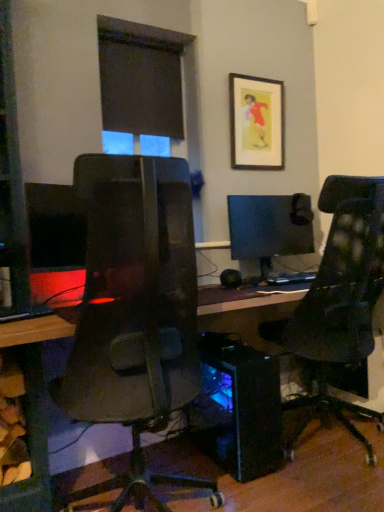
Question: From a real-world perspective, is matte black monitor at left, the 2th computer monitor positioned from the right, located beneath transparent blue computer tower at center?

Choices:
 (A) yes
 (B) no

Answer: (B)

Question: Considering the relative sizes of matte black monitor at left, the first computer monitor in the left-to-right sequence, and transparent blue computer tower at center in the image provided, is matte black monitor at left, the first computer monitor in the left-to-right sequence, smaller than transparent blue computer tower at center?

Choices:
 (A) no
 (B) yes

Answer: (B)

Question: From a real-world perspective, is matte black monitor at left, the 2th computer monitor positioned from the right, physically above transparent blue computer tower at center?

Choices:
 (A) no
 (B) yes

Answer: (B)

Question: Could you tell me if matte black monitor at left, the first computer monitor in the left-to-right sequence, is facing transparent blue computer tower at center?

Choices:
 (A) no
 (B) yes

Answer: (A)

Question: Is matte black monitor at left, the first computer monitor in the left-to-right sequence, taller than transparent blue computer tower at center?

Choices:
 (A) yes
 (B) no

Answer: (B)

Question: Considering the positions of point (243, 475) and point (51, 244), is point (243, 475) closer or farther from the camera than point (51, 244)?

Choices:
 (A) closer
 (B) farther

Answer: (B)

Question: In the image, is transparent blue computer tower at center positioned in front of or behind matte black monitor at left, which appears as the 1th computer monitor when viewed from the front?

Choices:
 (A) behind
 (B) front

Answer: (A)

Question: Considering the positions of transparent blue computer tower at center and matte black monitor at left, which appears as the 1th computer monitor when viewed from the front, in the image, is transparent blue computer tower at center bigger or smaller than matte black monitor at left, which appears as the 1th computer monitor when viewed from the front,?

Choices:
 (A) small
 (B) big

Answer: (B)

Question: From their relative heights in the image, would you say transparent blue computer tower at center is taller or shorter than matte black monitor at left, placed as the 2th computer monitor when sorted from back to front?

Choices:
 (A) short
 (B) tall

Answer: (B)

Question: Is wooden framed picture at upper center in front of or behind matte black monitor at center, the first computer monitor positioned from the back, in the image?

Choices:
 (A) front
 (B) behind

Answer: (B)

Question: Considering the positions of point (268, 120) and point (304, 223), is point (268, 120) closer or farther from the camera than point (304, 223)?

Choices:
 (A) farther
 (B) closer

Answer: (B)

Question: Based on their positions, is wooden framed picture at upper center located to the left or right of matte black monitor at center, the 1th computer monitor positioned from the right?

Choices:
 (A) right
 (B) left

Answer: (B)

Question: Is wooden framed picture at upper center bigger or smaller than matte black monitor at center, the 1th computer monitor positioned from the right?

Choices:
 (A) small
 (B) big

Answer: (A)

Question: Is transparent blue computer tower at center bigger or smaller than wooden framed picture at upper center?

Choices:
 (A) small
 (B) big

Answer: (B)

Question: From the image's perspective, is transparent blue computer tower at center located above or below wooden framed picture at upper center?

Choices:
 (A) below
 (B) above

Answer: (A)